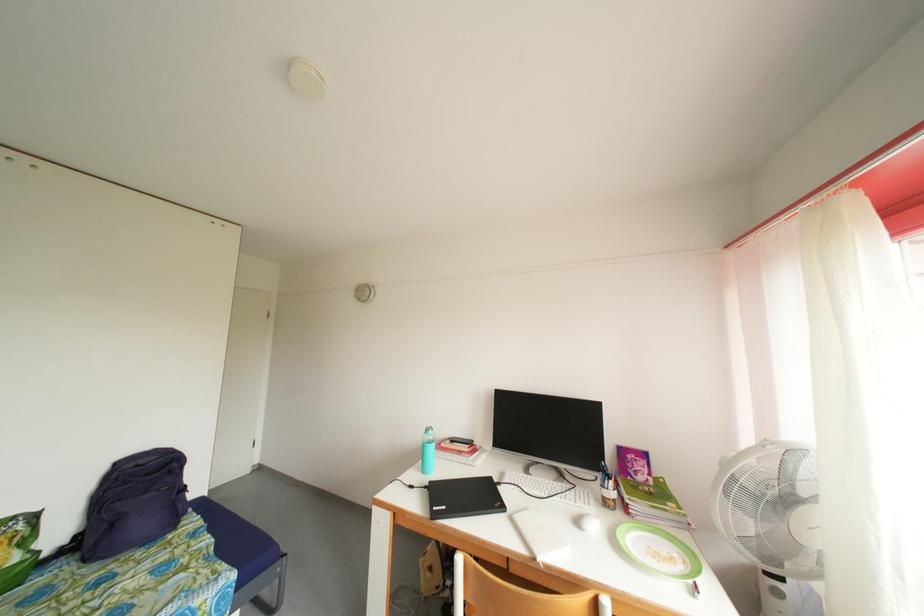
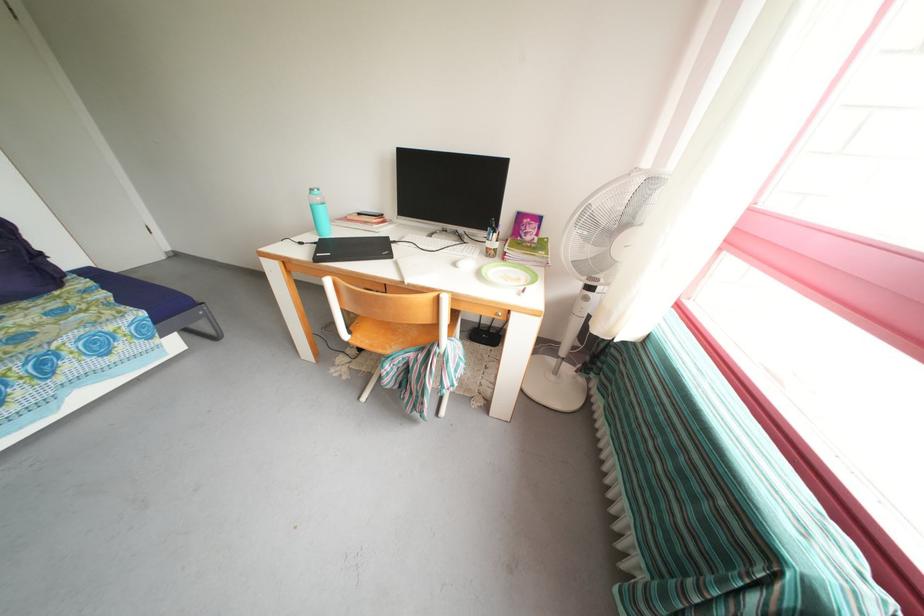
Where in the second image is the point corresponding to the point at 611,504 from the first image?

(494, 254)